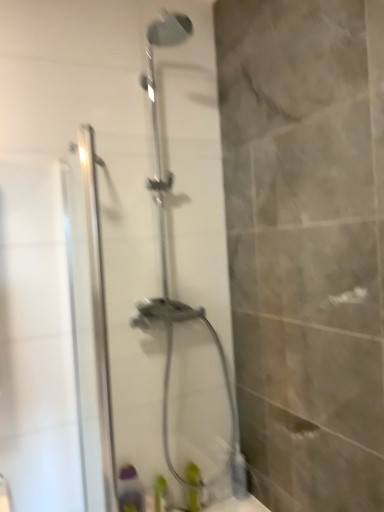
Question: From their relative heights in the image, would you say clear glass shower door at center is taller or shorter than green matte bottle at lower center, which is the 2th toiletry from left to right?

Choices:
 (A) tall
 (B) short

Answer: (A)

Question: Is clear glass shower door at center to the left or to the right of green matte bottle at lower center, which is the 2th toiletry from left to right, in the image?

Choices:
 (A) right
 (B) left

Answer: (A)

Question: Which of these objects is positioned farthest from the green plastic bottle at lower center, acting as the second toiletry starting from the right?

Choices:
 (A) green matte bottle at lower center, which is the 2th toiletry from left to right
 (B) clear glass shower door at center

Answer: (B)

Question: Based on their relative distances, which object is farther from the clear glass shower door at center?

Choices:
 (A) green matte bottle at lower center, which is the 2th toiletry from left to right
 (B) green plastic bottle at lower center, acting as the second toiletry starting from the right

Answer: (B)